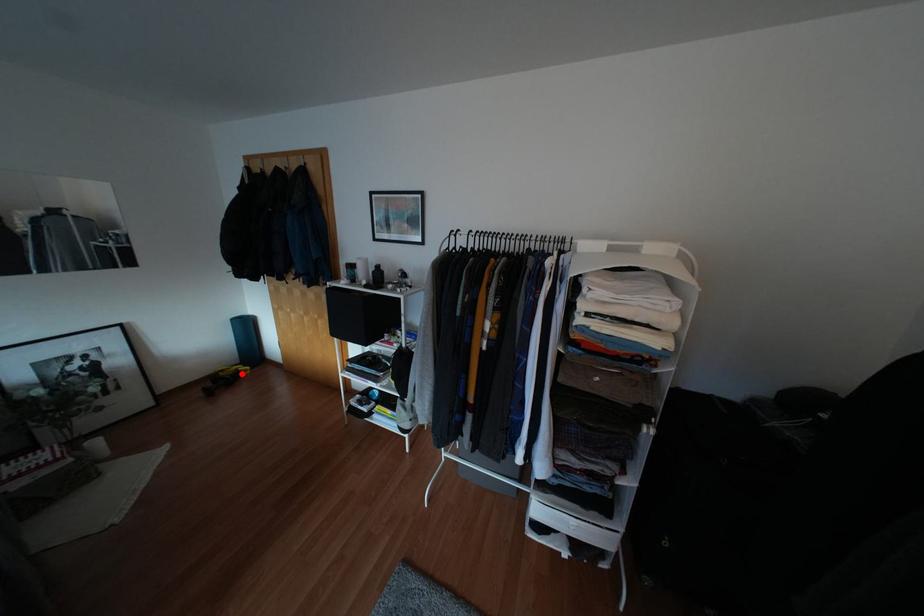
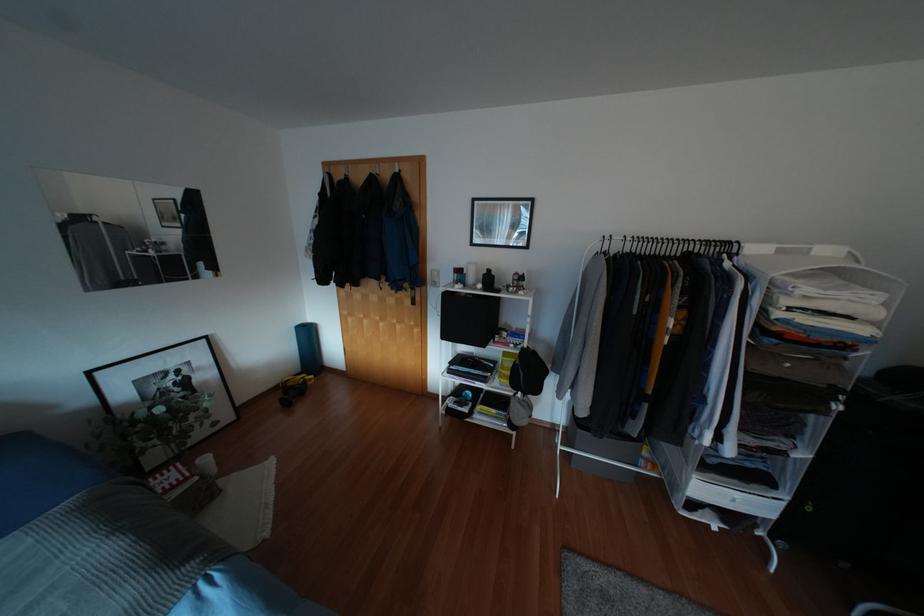
Question: I am providing you with two images of the same scene from different viewpoints. A red point is shown in image1. For the corresponding object point in image2, is it positioned nearer or farther from the camera?

Choices:
 (A) Nearer
 (B) Farther

Answer: (B)